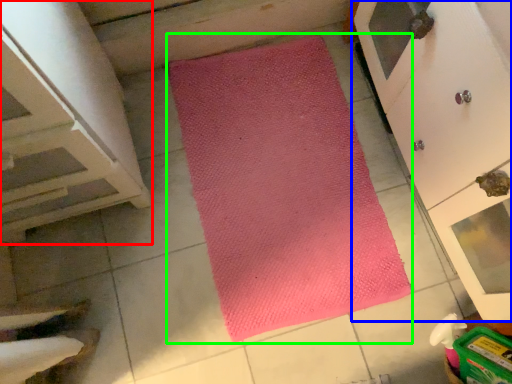
Question: Which object is the farthest from cabinetry (highlighted by a red box)? Choose among these: cupboard (highlighted by a blue box) or mat (highlighted by a green box).

Choices:
 (A) cupboard
 (B) mat

Answer: (A)